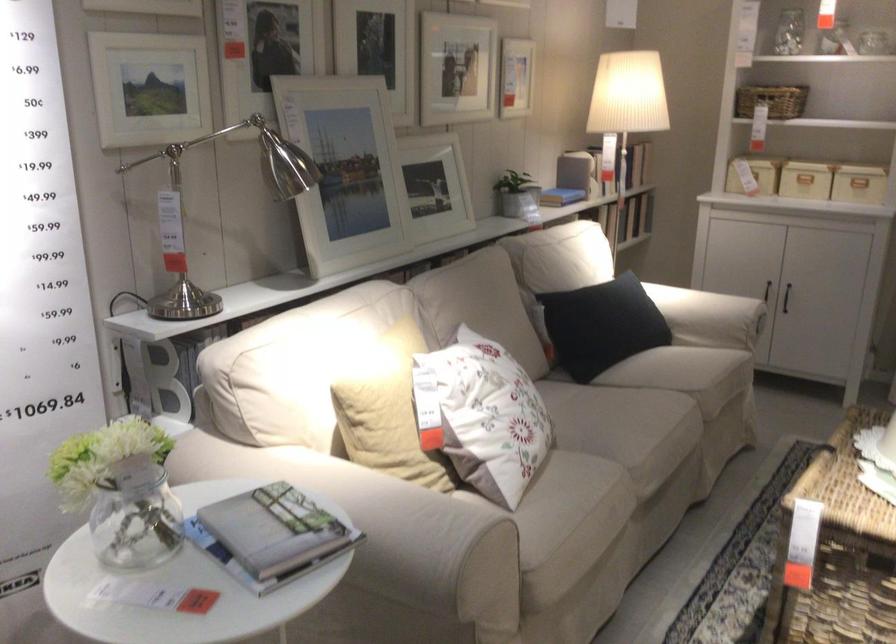
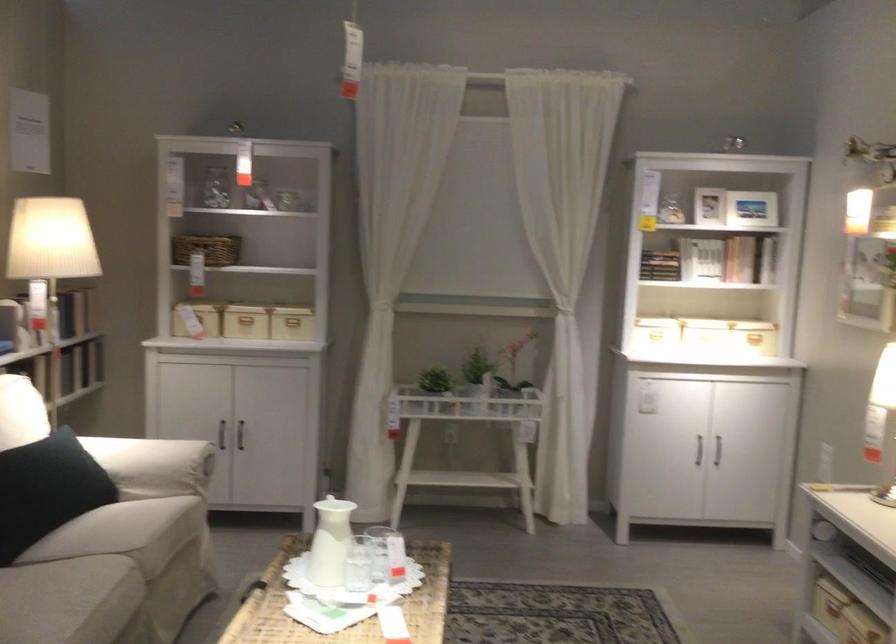
In the second image, find the point that corresponds to (x=709, y=304) in the first image.

(152, 465)